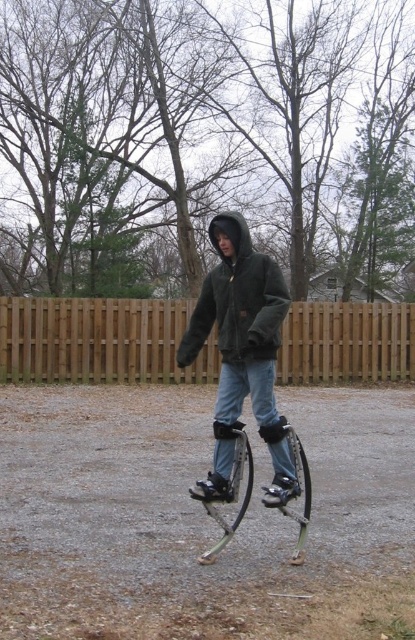
From the picture: You are standing on the stilts in the scene and want to cross to the residential area beyond the brown wooden fence at center. Based on your current position, is the fence directly in front of you or to the side?

The brown wooden fence at center is located at point coordinates of (x=99, y=340), meaning it is positioned directly in front of you, so you would need to move forward to reach the residential area beyond.

You are a photographer trying to capture the person on stilts. To get a clear shot of both the green fuzzy jacket at center and the silver metallic stilts at center, which object should you focus on first to ensure both are in focus?

The photographer should focus on the green fuzzy jacket at center first since it is located above the silver metallic stilts at center, ensuring both will be in focus when the camera adjusts for depth of field.

You are the person on the stilts in the image. You want to walk towards the residential neighborhood beyond the brown wooden fence at center. Which direction should you move relative to the silver metallic stilts at center?

The brown wooden fence at center is on the left side of the silver metallic stilts at center, so to reach the residential neighborhood beyond the fence, you should move to the right of the silver metallic stilts at center.